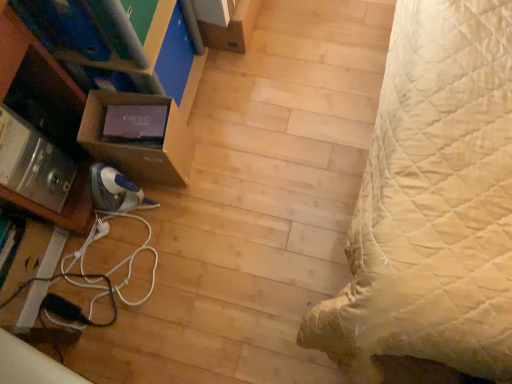
What are the coordinates of `vacant area that is in front of white cord at lower left` in the screenshot? It's located at (144, 341).